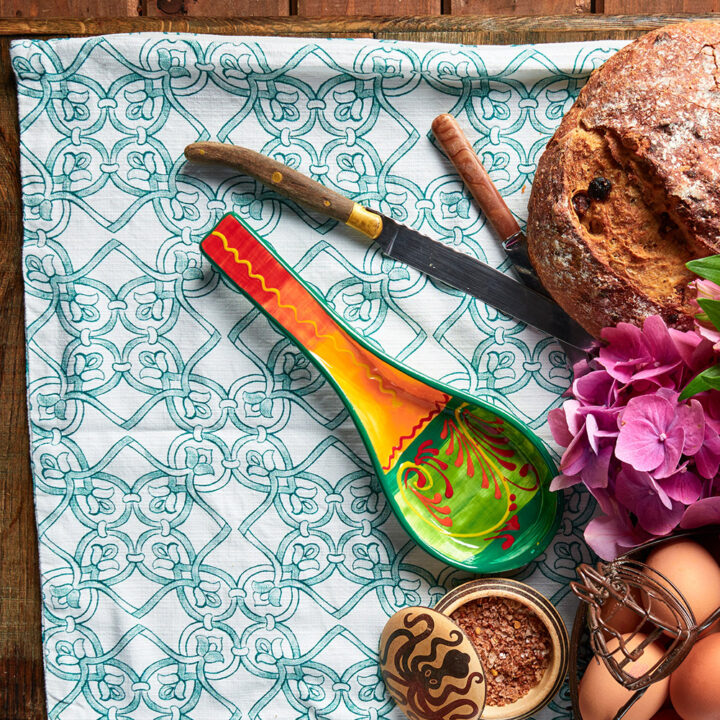
The height and width of the screenshot is (720, 720). I want to click on butter knife, so click(525, 266).